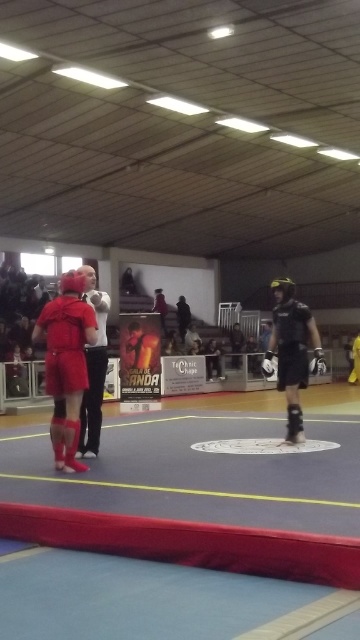
You are a spectator standing at the edge of the gymnasium. You want to take a photo of the point at coordinate point (69, 276). Can you estimate how far you need to walk to reach that point?

The distance of point (69, 276) from viewer is 18.09 feet, so you need to walk approximately 18.09 feet to reach that point.

You are a photographer positioned at the camera location. You want to capture a close shot of the competitor in red protective gear on the left side. The focus point of your camera is set to point at coordinates point (75, 468). Will this focus point be sufficient to capture the competitor in red protective gear on the left side clearly?

The focus point at point (75, 468) is 5.56 meters away from the camera. Since the competitor in red protective gear on the left side is within this distance, the focus point should be sufficient to capture them clearly.